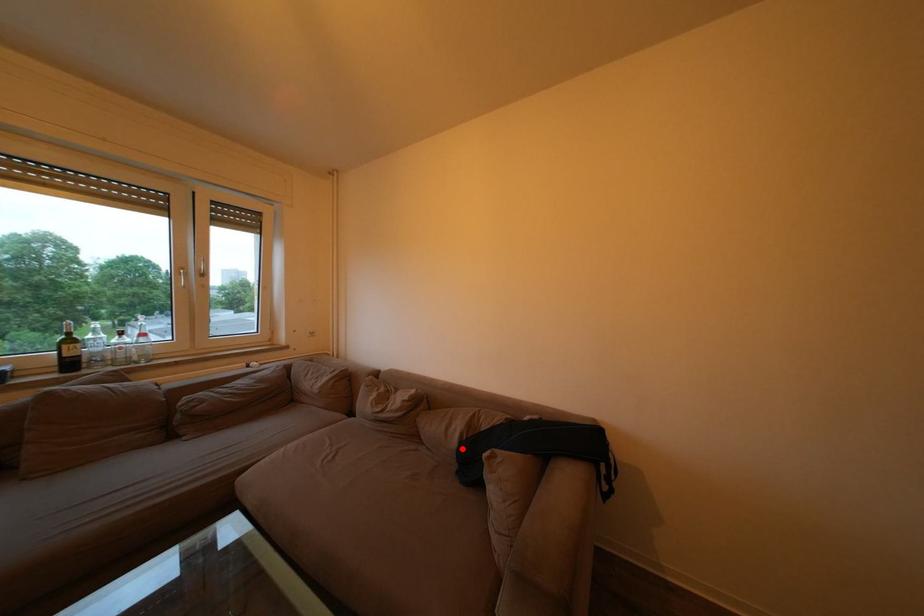
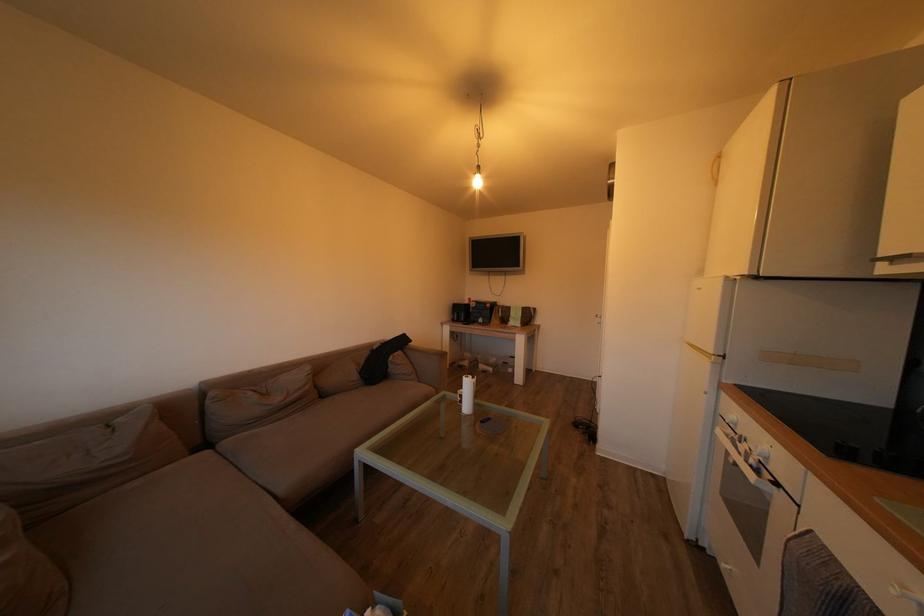
Question: I am providing you with two images of the same scene from different viewpoints. Image1 has a red point marked. In image2, the corresponding 3D location appears at what relative position? Reply with the corresponding letter.

Choices:
 (A) Closer
 (B) Farther

Answer: (A)